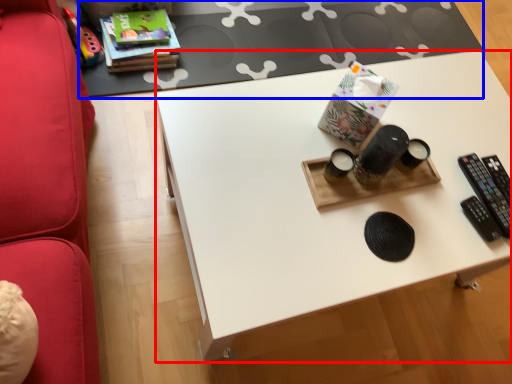
Question: Which of the following is the closest to the observer, desk (highlighted by a red box) or table (highlighted by a blue box)?

Choices:
 (A) desk
 (B) table

Answer: (A)